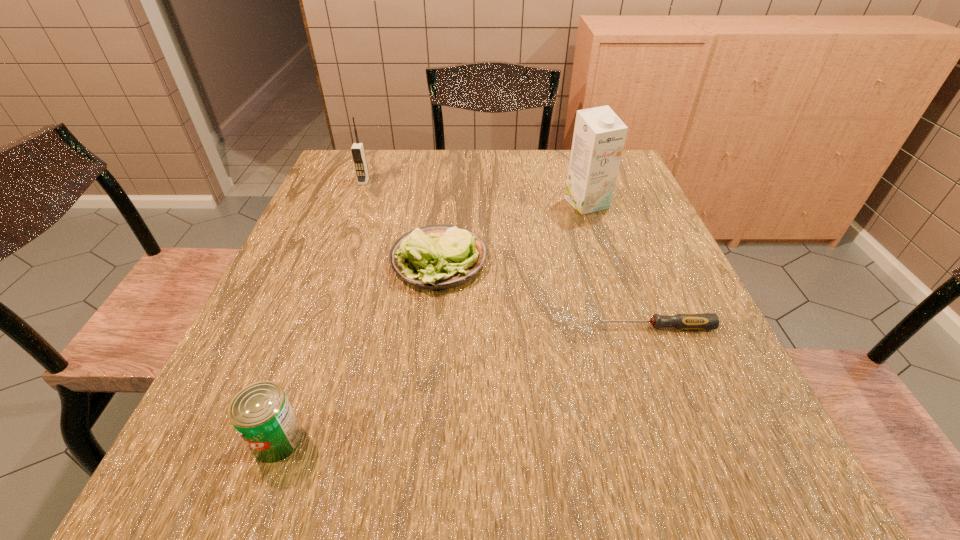
Where is `can that is at the left edge`? can that is at the left edge is located at coordinates (261, 413).

This screenshot has width=960, height=540. In order to click on carton at the right edge in this screenshot , I will do `click(599, 135)`.

This screenshot has height=540, width=960. Find the location of `screwdriver that is positioned at the right edge`. screwdriver that is positioned at the right edge is located at coordinates (685, 321).

This screenshot has height=540, width=960. In order to click on object that is at the far left corner in this screenshot , I will do `click(357, 150)`.

Image resolution: width=960 pixels, height=540 pixels. In order to click on object present at the near left corner in this screenshot , I will do `click(261, 413)`.

In the image, there is a desktop. Identify the location of vacant space at the far edge. The width and height of the screenshot is (960, 540). (462, 165).

Locate an element on the screen. This screenshot has width=960, height=540. free location at the near edge is located at coordinates (402, 484).

Locate an element on the screen. The height and width of the screenshot is (540, 960). vacant region at the left edge of the desktop is located at coordinates (316, 198).

Identify the location of vacant space at the right edge of the desktop. The height and width of the screenshot is (540, 960). (699, 309).

Where is `free space at the far left corner`? The width and height of the screenshot is (960, 540). free space at the far left corner is located at coordinates (350, 179).